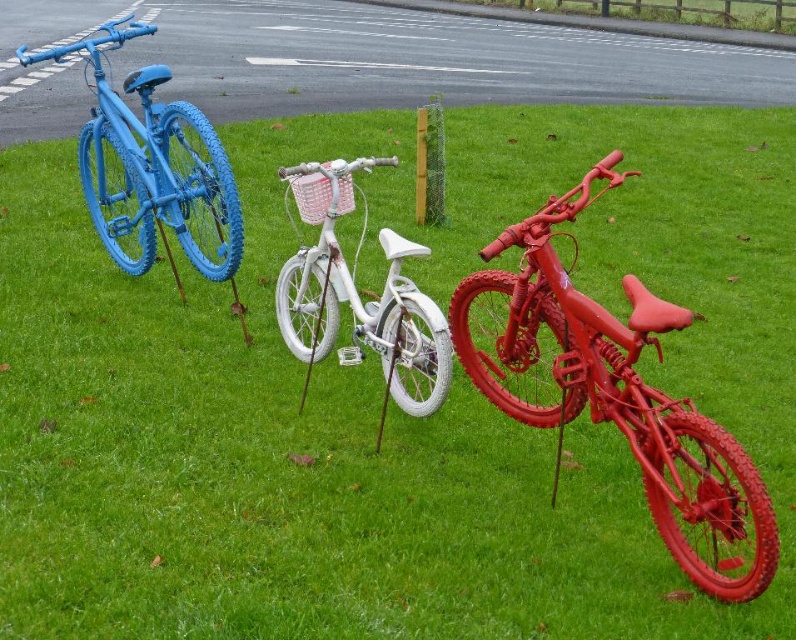
Question: Considering the real-world distances, which object is farthest from the white glossy bicycle at center?

Choices:
 (A) shiny red bicycle at right
 (B) matte blue bicycle at left

Answer: (B)

Question: Can you confirm if matte blue bicycle at left is positioned to the left of white glossy bicycle at center?

Choices:
 (A) yes
 (B) no

Answer: (A)

Question: Which point is farther to the camera?

Choices:
 (A) (377, 237)
 (B) (759, 496)
 (C) (116, 168)

Answer: (A)

Question: Which of the following is the closest to the observer?

Choices:
 (A) shiny red bicycle at right
 (B) matte blue bicycle at left

Answer: (A)

Question: Can you confirm if shiny red bicycle at right is smaller than matte blue bicycle at left?

Choices:
 (A) yes
 (B) no

Answer: (A)

Question: Does shiny red bicycle at right have a greater width compared to white glossy bicycle at center?

Choices:
 (A) no
 (B) yes

Answer: (B)